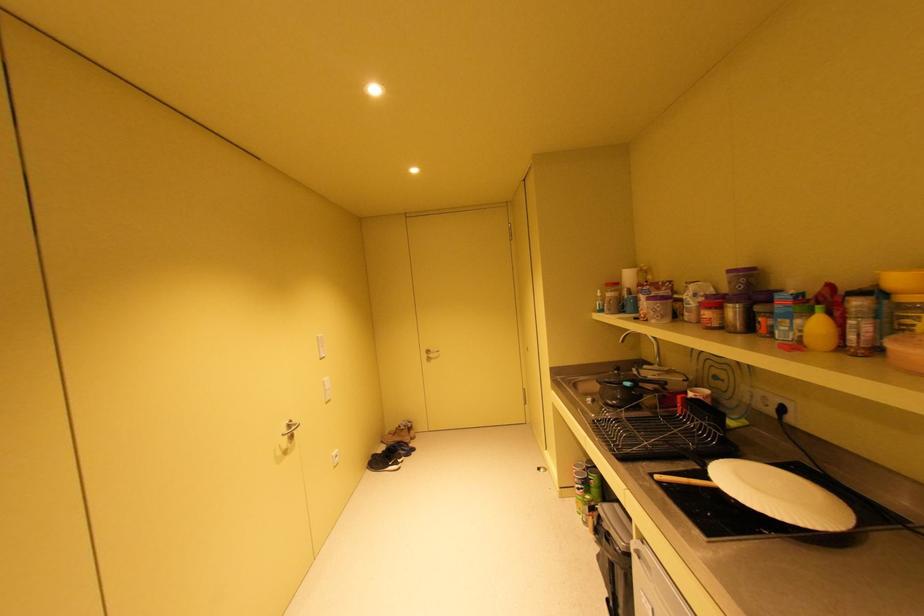
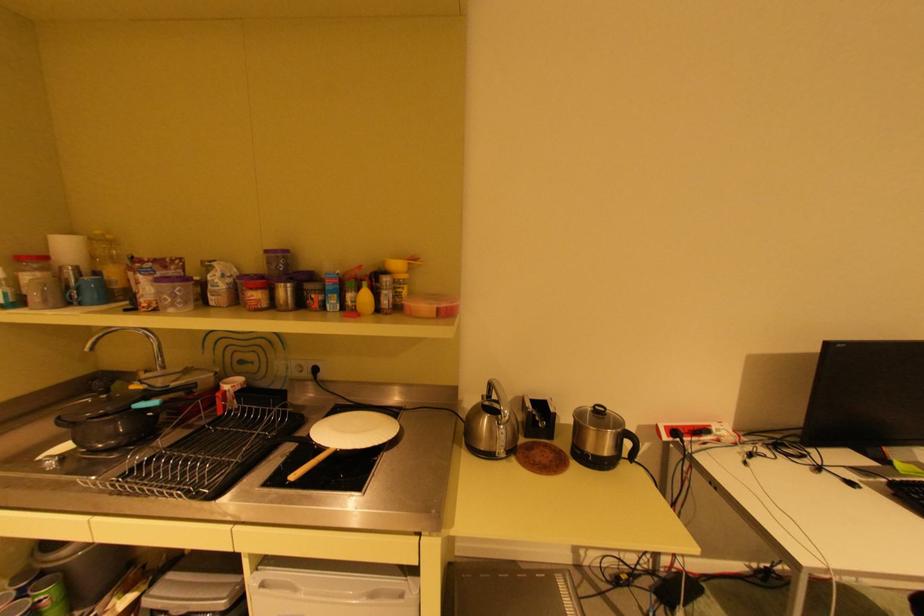
The point at [626,339] is marked in the first image. Where is the corresponding point in the second image?

(92, 347)